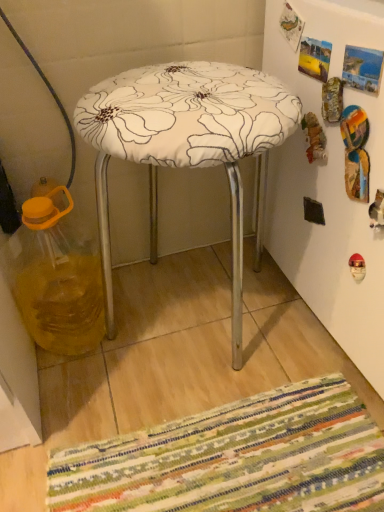
Question: Does white fabric-covered stool at center have a greater height compared to translucent yellow liquid at left?

Choices:
 (A) no
 (B) yes

Answer: (B)

Question: Is white fabric-covered stool at center not within translucent yellow liquid at left?

Choices:
 (A) no
 (B) yes

Answer: (B)

Question: Considering the relative sizes of white fabric-covered stool at center and translucent yellow liquid at left in the image provided, is white fabric-covered stool at center shorter than translucent yellow liquid at left?

Choices:
 (A) yes
 (B) no

Answer: (B)

Question: Can you confirm if white fabric-covered stool at center is smaller than translucent yellow liquid at left?

Choices:
 (A) yes
 (B) no

Answer: (B)

Question: Considering the relative positions of white fabric-covered stool at center and translucent yellow liquid at left in the image provided, is white fabric-covered stool at center to the left of translucent yellow liquid at left from the viewer's perspective?

Choices:
 (A) no
 (B) yes

Answer: (A)

Question: Does white fabric-covered stool at center have a greater width compared to translucent yellow liquid at left?

Choices:
 (A) no
 (B) yes

Answer: (B)

Question: From the image's perspective, is translucent yellow liquid at left above white fabric-covered stool at center?

Choices:
 (A) yes
 (B) no

Answer: (B)

Question: Is the position of translucent yellow liquid at left more distant than that of white fabric-covered stool at center?

Choices:
 (A) yes
 (B) no

Answer: (A)

Question: From a real-world perspective, is translucent yellow liquid at left physically below white fabric-covered stool at center?

Choices:
 (A) yes
 (B) no

Answer: (A)

Question: Does translucent yellow liquid at left have a greater height compared to white fabric-covered stool at center?

Choices:
 (A) no
 (B) yes

Answer: (A)

Question: Is translucent yellow liquid at left oriented towards white fabric-covered stool at center?

Choices:
 (A) yes
 (B) no

Answer: (B)

Question: Can you see translucent yellow liquid at left touching white fabric-covered stool at center?

Choices:
 (A) no
 (B) yes

Answer: (A)

Question: From the image's perspective, is translucent yellow liquid at left positioned above or below white fabric-covered stool at center?

Choices:
 (A) above
 (B) below

Answer: (B)